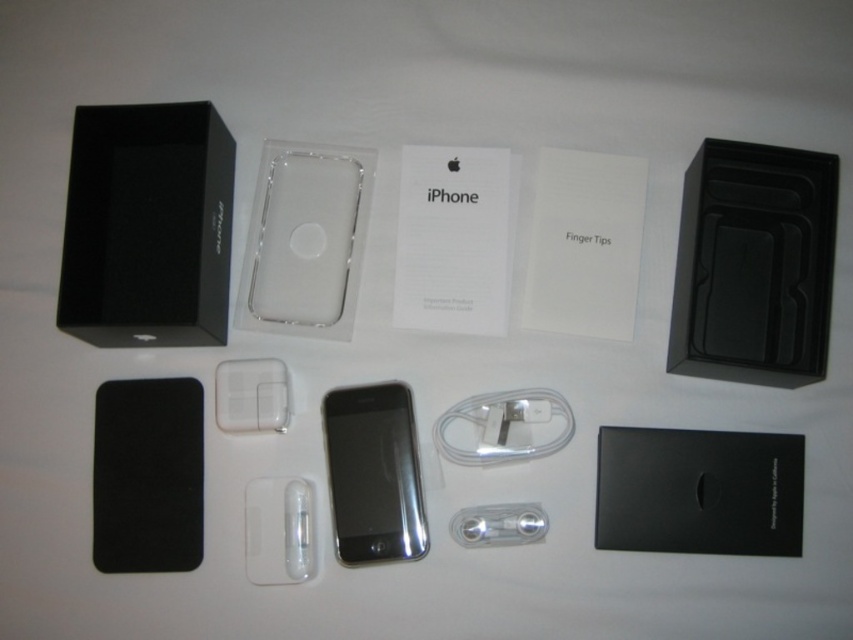
You are setting up a display for a tech store and need to arrange the items shown. If you want to ensure the sleek black phone at center is visible to customers, should you place it in front of or behind the white glossy ipod at center?

You should place the sleek black phone at center in front of the white glossy ipod at center to ensure it is visible, as the description states that the sleek black phone at center is already positioned in front of the white glossy ipod at center.